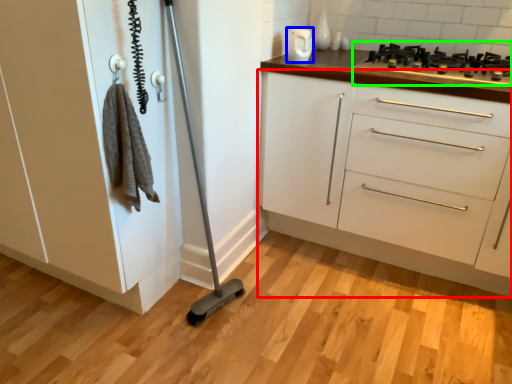
Question: Which is farther away from chest of drawers (highlighted by a red box)? appliance (highlighted by a blue box) or gas stove (highlighted by a green box)?

Choices:
 (A) appliance
 (B) gas stove

Answer: (A)